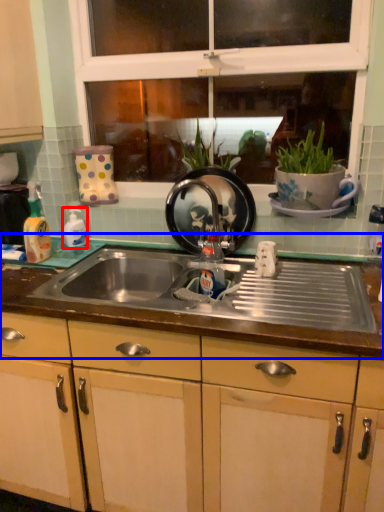
Question: Which object is closer to the camera taking this photo, bottle (highlighted by a red box) or countertop (highlighted by a blue box)?

Choices:
 (A) bottle
 (B) countertop

Answer: (B)